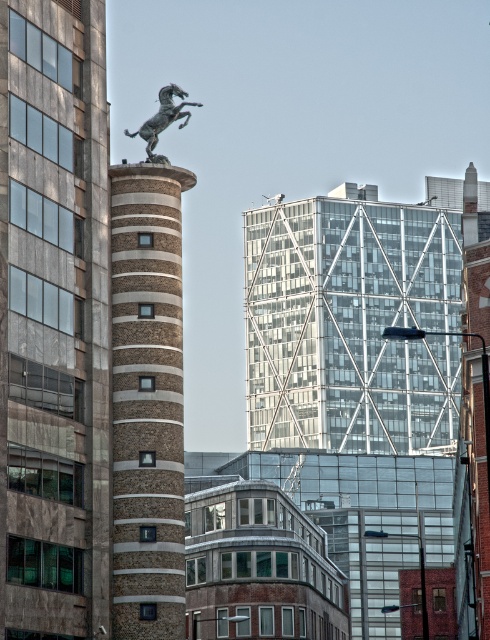
Does brown textured column at center-left have a smaller size compared to brown brick tower at center?

Incorrect, brown textured column at center-left is not smaller in size than brown brick tower at center.

Between brown textured column at center-left and brown brick tower at center, which one has more height?

brown textured column at center-left

The width and height of the screenshot is (490, 640). In order to click on brown textured column at center-left in this screenshot , I will do `click(53, 321)`.

The width and height of the screenshot is (490, 640). What are the coordinates of `brown textured column at center-left` in the screenshot? It's located at (53, 321).

Does brown textured column at center-left appear on the right side of transparent glass building at center?

In fact, brown textured column at center-left is to the left of transparent glass building at center.

Can you confirm if brown textured column at center-left is positioned to the left of transparent glass building at center?

Correct, you'll find brown textured column at center-left to the left of transparent glass building at center.

This screenshot has height=640, width=490. What do you see at coordinates (53, 321) in the screenshot? I see `brown textured column at center-left` at bounding box center [53, 321].

At what (x,y) coordinates should I click in order to perform the action: click on brown textured column at center-left. Please return your answer as a coordinate pair (x, y). This screenshot has height=640, width=490. Looking at the image, I should click on (53, 321).

Between point (292, 348) and point (152, 134), which one is positioned in front?

Point (152, 134) is more forward.

Which of these two, transparent glass building at center or bronze horse at upper center, stands taller?

transparent glass building at center

Describe the element at coordinates (350, 323) in the screenshot. The width and height of the screenshot is (490, 640). I see `transparent glass building at center` at that location.

I want to click on transparent glass building at center, so click(350, 323).